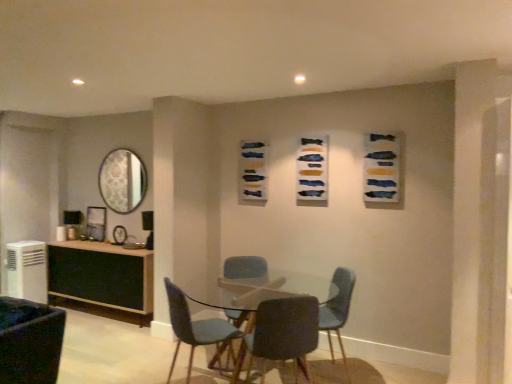
Locate an element on the screen. This screenshot has width=512, height=384. free space above silver/metallic mirror at upper left (from a real-world perspective) is located at coordinates (111, 147).